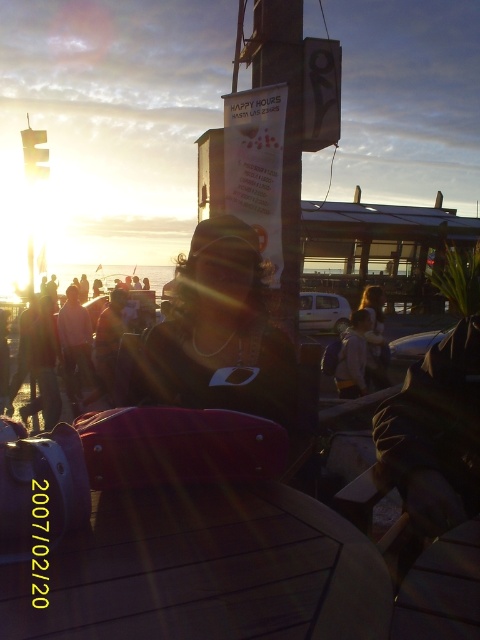
Question: Based on their relative distances, which object is nearer to the light brown leather jacket at center?

Choices:
 (A) wooden table at center
 (B) white paper sign at center

Answer: (B)

Question: Among these objects, which one is farthest from the camera?

Choices:
 (A) white paper sign at center
 (B) light brown leather jacket at center
 (C) wooden table at center

Answer: (B)

Question: Is wooden table at center smaller than light brown leather jacket at center?

Choices:
 (A) yes
 (B) no

Answer: (A)

Question: Is white paper sign at center below light brown leather jacket at center?

Choices:
 (A) no
 (B) yes

Answer: (A)

Question: Which object is positioned closest to the light brown leather jacket at center?

Choices:
 (A) wooden table at center
 (B) white paper sign at center

Answer: (B)

Question: Can you confirm if wooden table at center is positioned to the right of light brown leather jacket at center?

Choices:
 (A) yes
 (B) no

Answer: (B)